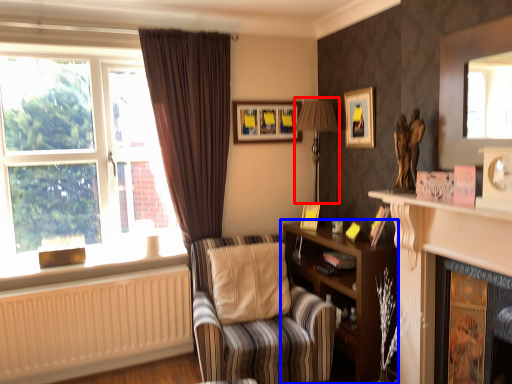
Question: Among these objects, which one is nearest to the camera, table lamp (highlighted by a red box) or shelf (highlighted by a blue box)?

Choices:
 (A) table lamp
 (B) shelf

Answer: (B)